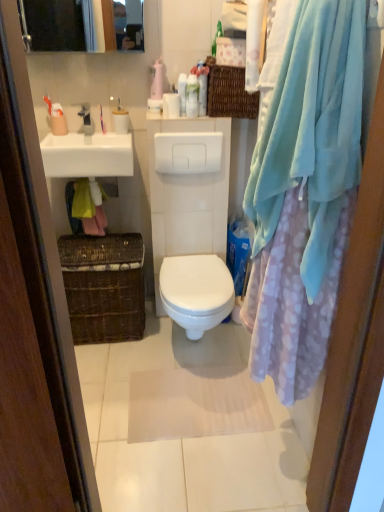
Question: Is white glossy bottle at upper center, which is the second toiletry in right-to-left order, facing away from white glossy toilet paper at upper center, the 3th toiletry viewed from the left?

Choices:
 (A) yes
 (B) no

Answer: (B)

Question: Does white glossy bottle at upper center, which is the second toiletry in right-to-left order, have a larger size compared to white glossy toilet paper at upper center, the 4th toiletry viewed from the right?

Choices:
 (A) no
 (B) yes

Answer: (A)

Question: Does white glossy bottle at upper center, the fifth toiletry positioned from the left, have a greater width compared to white glossy toilet paper at upper center, the 3th toiletry viewed from the left?

Choices:
 (A) yes
 (B) no

Answer: (B)

Question: Can you confirm if white glossy bottle at upper center, the fifth toiletry positioned from the left, is taller than white glossy toilet paper at upper center, the 4th toiletry viewed from the right?

Choices:
 (A) yes
 (B) no

Answer: (A)

Question: Is white glossy bottle at upper center, which is the second toiletry in right-to-left order, shorter than white glossy toilet paper at upper center, the 4th toiletry viewed from the right?

Choices:
 (A) no
 (B) yes

Answer: (A)

Question: In terms of width, does satin silver faucet at upper center look wider or thinner when compared to white glossy bottle at upper center, which is the second toiletry in right-to-left order?

Choices:
 (A) wide
 (B) thin

Answer: (A)

Question: Is point (87, 122) closer or farther from the camera than point (188, 87)?

Choices:
 (A) farther
 (B) closer

Answer: (A)

Question: Based on their sizes in the image, would you say satin silver faucet at upper center is bigger or smaller than white glossy bottle at upper center, the fifth toiletry positioned from the left?

Choices:
 (A) small
 (B) big

Answer: (B)

Question: Do you think satin silver faucet at upper center is within white glossy bottle at upper center, the fifth toiletry positioned from the left, or outside of it?

Choices:
 (A) inside
 (B) outside

Answer: (B)

Question: Would you say white glossy sink at upper left is inside or outside matte white medicine cabinet at upper left?

Choices:
 (A) outside
 (B) inside

Answer: (A)

Question: Is white glossy sink at upper left wider or thinner than matte white medicine cabinet at upper left?

Choices:
 (A) thin
 (B) wide

Answer: (B)

Question: Based on their sizes in the image, would you say white glossy sink at upper left is bigger or smaller than matte white medicine cabinet at upper left?

Choices:
 (A) big
 (B) small

Answer: (A)

Question: From a real-world perspective, is white glossy sink at upper left physically located above or below matte white medicine cabinet at upper left?

Choices:
 (A) below
 (B) above

Answer: (A)

Question: Does point (56, 132) appear closer or farther from the camera than point (167, 266)?

Choices:
 (A) closer
 (B) farther

Answer: (A)

Question: Relative to white glossy toilet at center, is matte plastic toothbrush at upper left, which appears as the sixth toiletry when viewed from the right, in front or behind?

Choices:
 (A) front
 (B) behind

Answer: (B)